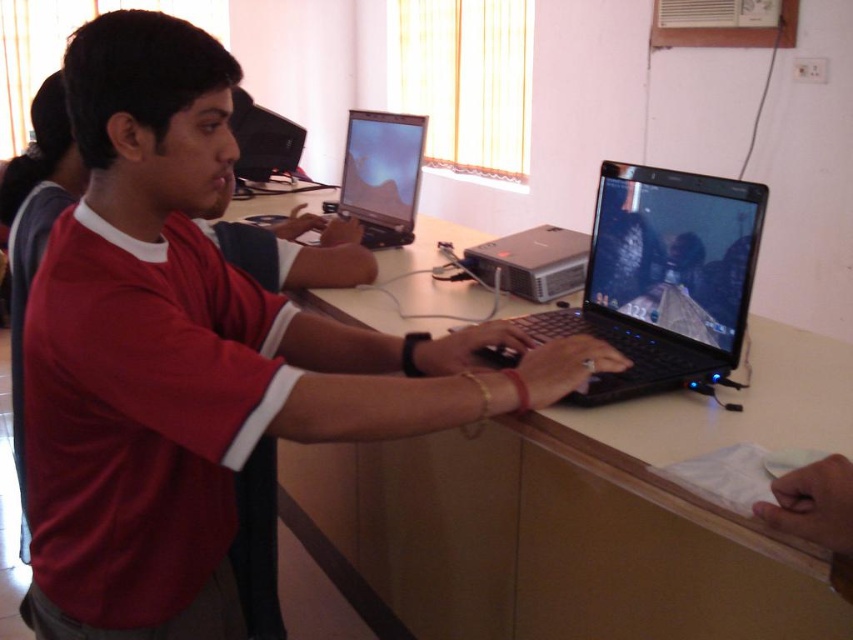
Does shiny black laptop at center have a smaller size compared to black plastic computer at center?

Actually, shiny black laptop at center might be larger than black plastic computer at center.

Who is more distant from viewer, (357, 204) or (554, 244)?

The point (357, 204) is more distant.

Find the location of a particular element. The width and height of the screenshot is (853, 640). shiny black laptop at center is located at coordinates (381, 176).

Does white glossy table at center come in front of shiny black laptop at center?

Yes, white glossy table at center is in front of shiny black laptop at center.

Consider the image. Is white glossy table at center to the left of shiny black laptop at center from the viewer's perspective?

No, white glossy table at center is not to the left of shiny black laptop at center.

The image size is (853, 640). Identify the location of white glossy table at center. (579, 516).

Is black glossy laptop at center thinner than shiny black laptop at center?

No.

Locate an element on the screen. Image resolution: width=853 pixels, height=640 pixels. black glossy laptop at center is located at coordinates (663, 280).

Does point (648, 333) lie behind point (366, 124)?

No.

Find the location of `black glossy laptop at center`. black glossy laptop at center is located at coordinates (663, 280).